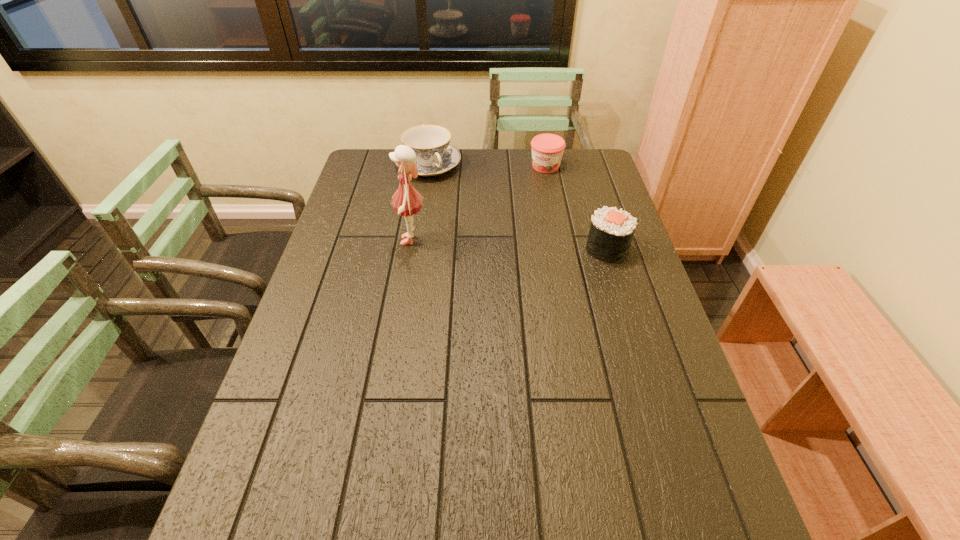
The height and width of the screenshot is (540, 960). Find the location of `blank area located 0.060m on the front label of the shortest object`. blank area located 0.060m on the front label of the shortest object is located at coordinates (537, 183).

Where is `vacant space located on the front label of the shortest object`? vacant space located on the front label of the shortest object is located at coordinates click(536, 185).

Find the location of a particular element. This screenshot has height=540, width=960. blank space located 0.130m with the handle on the side of the chinaware is located at coordinates (460, 199).

Find the location of a particular element. free spot located with the handle on the side of the chinaware is located at coordinates (494, 238).

You are a GUI agent. You are given a task and a screenshot of the screen. Output one action in this format:
    pyautogui.click(x=<x>, y=<y>)
    Task: Click on the vacant space located 0.380m with the handle on the side of the chinaware
    The image size is (960, 540).
    Given the screenshot: What is the action you would take?
    tap(498, 241)

You are a GUI agent. You are given a task and a screenshot of the screen. Output one action in this format:
    pyautogui.click(x=<x>, y=<y>)
    Task: Click on the jam at the far edge
    Image resolution: width=960 pixels, height=540 pixels.
    Given the screenshot: What is the action you would take?
    pyautogui.click(x=547, y=149)

This screenshot has height=540, width=960. What are the coordinates of `chinaware at the far edge` in the screenshot? It's located at (434, 155).

The image size is (960, 540). What are the coordinates of `object located at the left edge` in the screenshot? It's located at (434, 155).

I want to click on sushi at the right edge, so click(611, 232).

Image resolution: width=960 pixels, height=540 pixels. In order to click on jam positioned at the right edge in this screenshot , I will do `click(547, 149)`.